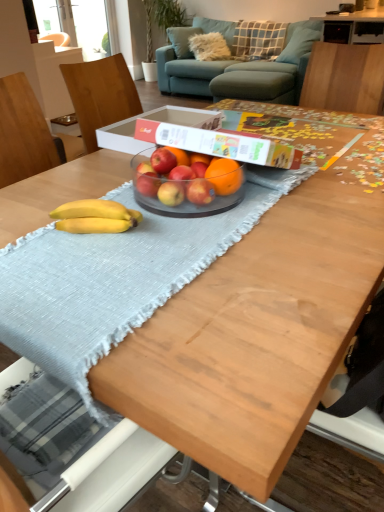
At what (x,y) coordinates should I click in order to perform the action: click on free space in front of red matte apple at center, marked as the 1th apple in a right-to-left arrangement. Please return your answer as a coordinate pair (x, y). The width and height of the screenshot is (384, 512). Looking at the image, I should click on (181, 238).